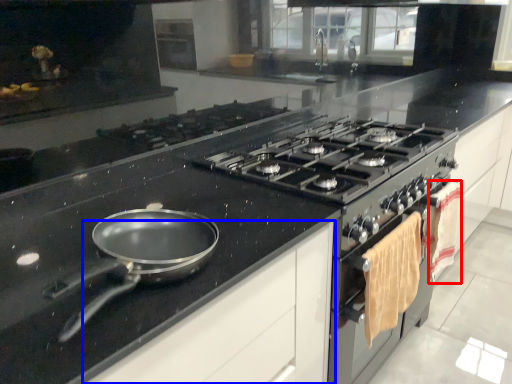
Question: Which object is further to the camera taking this photo, material (highlighted by a red box) or cabinetry (highlighted by a blue box)?

Choices:
 (A) material
 (B) cabinetry

Answer: (A)